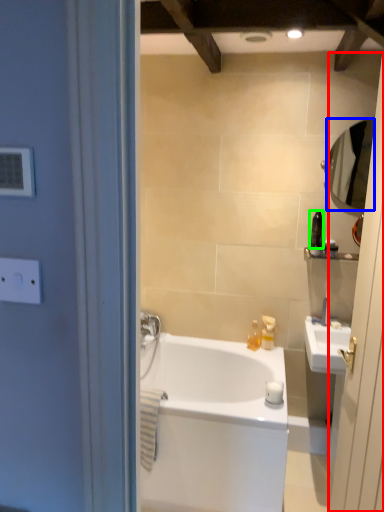
Question: Based on their relative distances, which object is farther from screen door (highlighted by a red box)? Choose from mirror (highlighted by a blue box) and toiletry (highlighted by a green box).

Choices:
 (A) mirror
 (B) toiletry

Answer: (B)